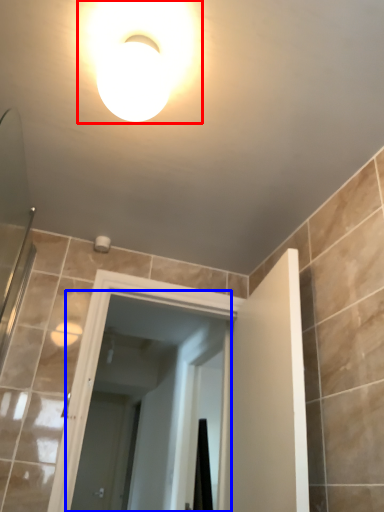
Question: Among these objects, which one is nearest to the camera, light fixture (highlighted by a red box) or screen door (highlighted by a blue box)?

Choices:
 (A) light fixture
 (B) screen door

Answer: (A)